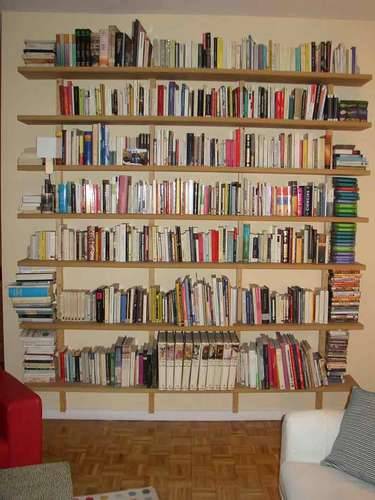
At what (x,y) coordinates should I click in order to perform the action: click on white sofa. Please return your answer as a coordinate pair (x, y). This screenshot has height=500, width=375. Looking at the image, I should click on (317, 491).